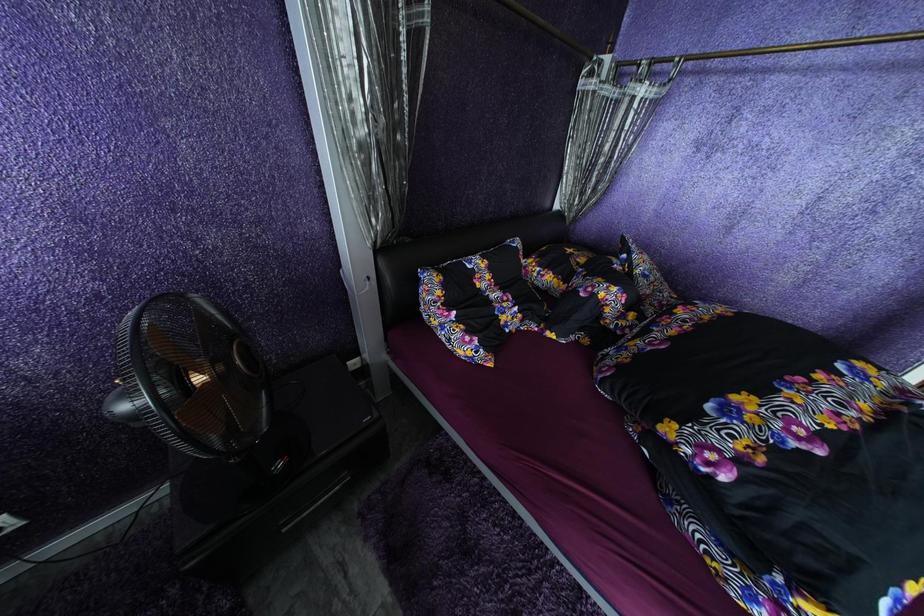
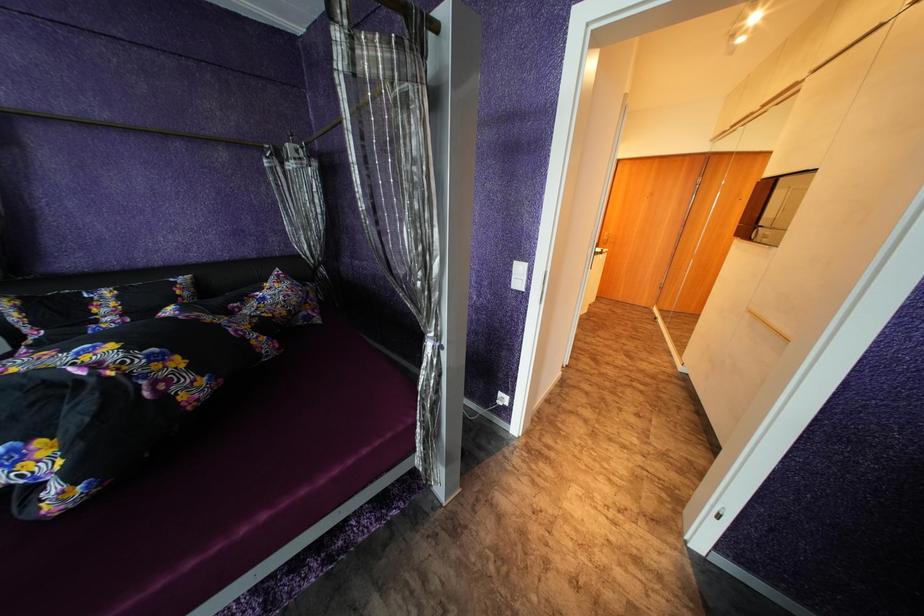
Question: Which direction would the cameraman need to move to produce the second image? Reply with the corresponding letter.

Choices:
 (A) Left
 (B) Right
 (C) Forward
 (D) Backward

Answer: (B)